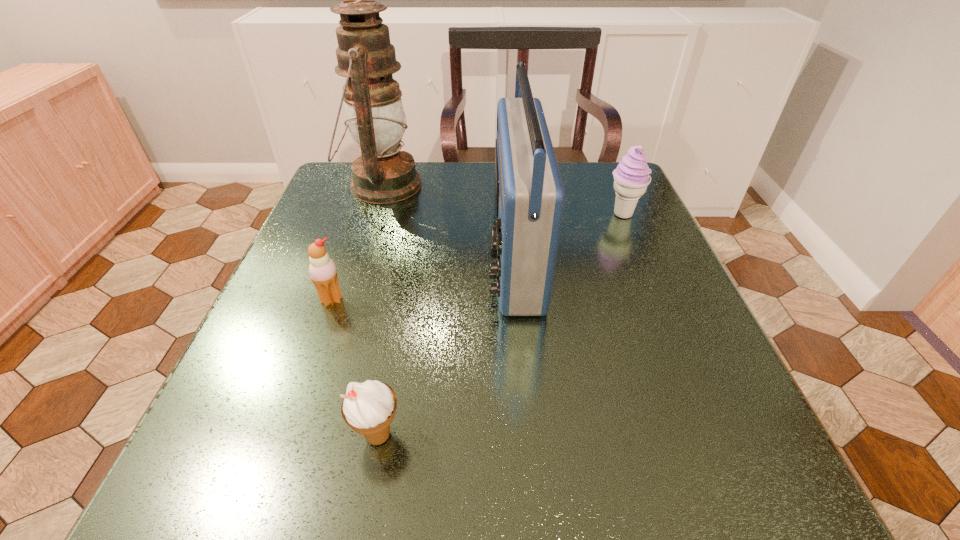
Locate which icecream ranks second in proximity to the fourth object from left to right. Please provide its 2D coordinates. Your answer should be formatted as a tuple, i.e. [(x, y)], where the tuple contains the x and y coordinates of a point satisfying the conditions above.

[(368, 408)]

Locate an element on the screen. This screenshot has height=540, width=960. icecream object that ranks as the second closest to the tallest object is located at coordinates (631, 177).

Where is `free space that satisfies the following two spatial constraints: 1. on the front panel of the radio receiver; 2. on the front side of the nearest object`? This screenshot has width=960, height=540. free space that satisfies the following two spatial constraints: 1. on the front panel of the radio receiver; 2. on the front side of the nearest object is located at coordinates (530, 435).

The height and width of the screenshot is (540, 960). I want to click on vacant space that satisfies the following two spatial constraints: 1. on the front side of the nearest object; 2. on the left side of the tallest object, so click(x=303, y=435).